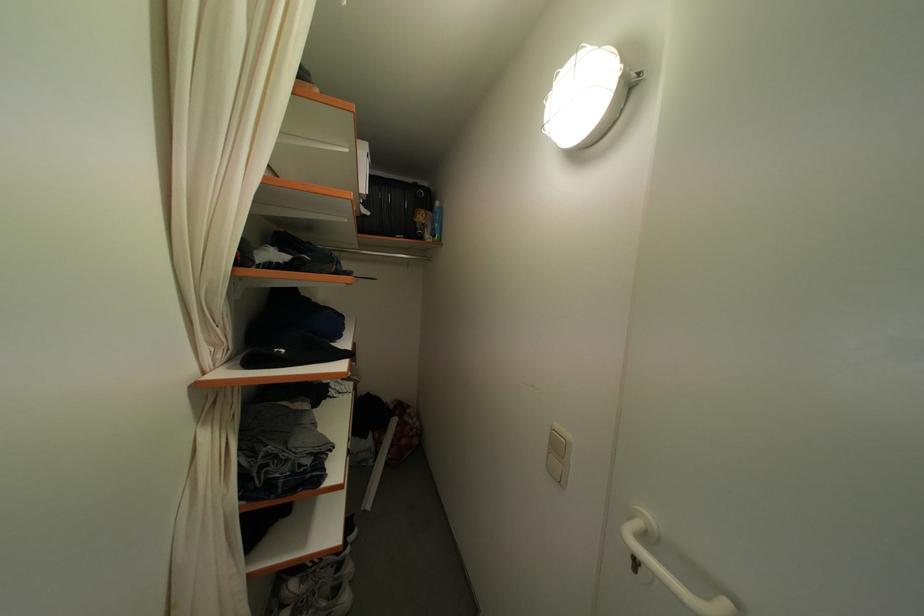
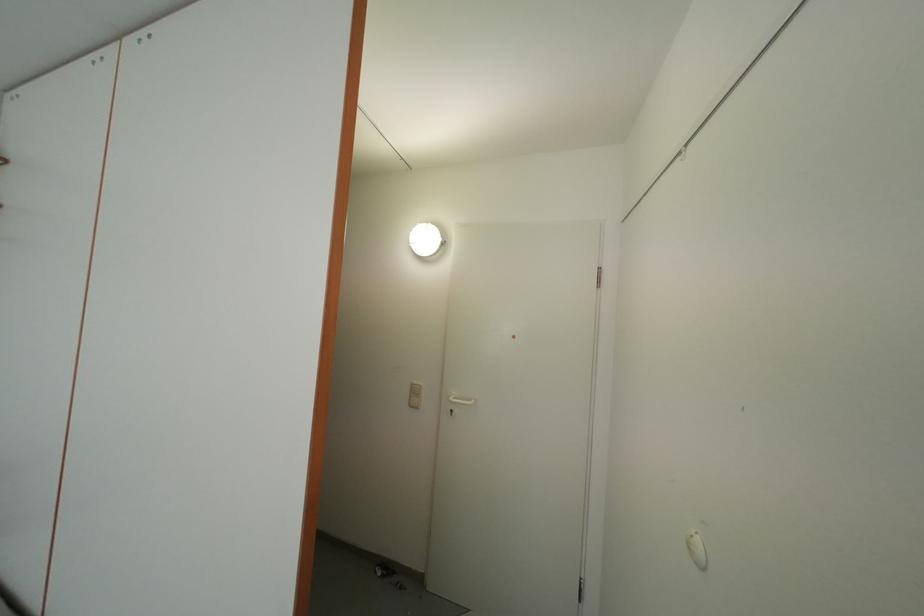
Question: How did the camera likely rotate?

Choices:
 (A) Left
 (B) Right
 (C) Up
 (D) Down

Answer: (B)